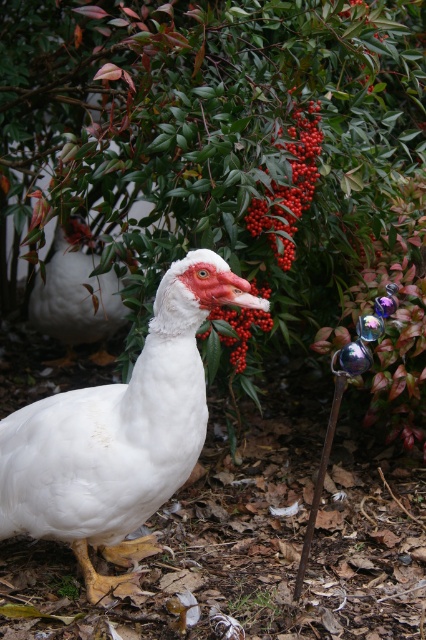
You are standing in a garden and want to take a closer look at the green leafy bush at center. If you walk forward 2 meters, will you be able to see the entire bush in your field of view?

The green leafy bush at center is 2.36 meters from the camera. If you walk forward 2 meters, you will be 0.36 meters away from the bush, so you will be able to see the entire bush in your field of view.

You are standing in the garden and want to place a new decorative item exactly where the green leafy bush at center is located. According to the image, what are the coordinates of the location where you should place it?

The coordinates for the green leafy bush at center are at point [215,138].

From the picture: You are a gardener checking the garden. You see the green leafy bush at center and the shiny red berries at center. Which one is taller?

The green leafy bush at center is much taller than the shiny red berries at center.